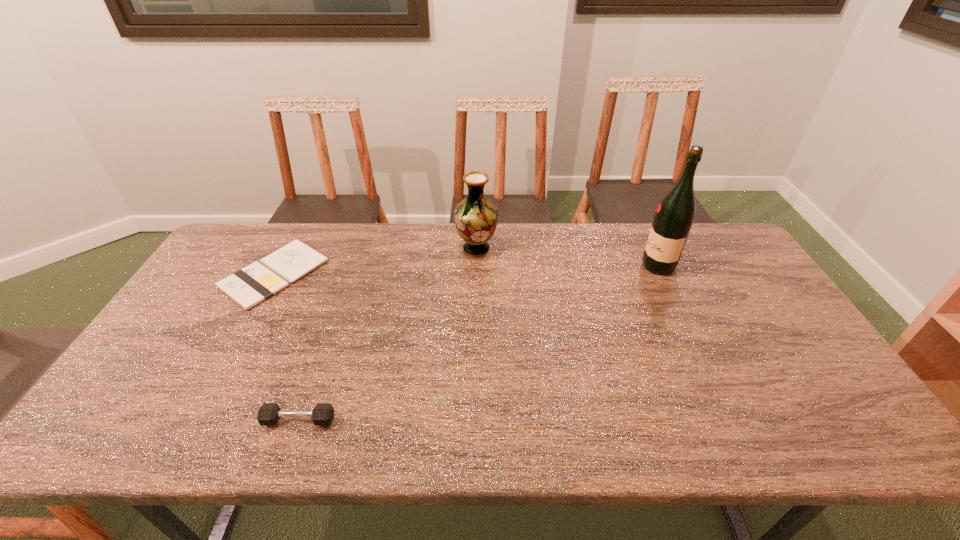
Image resolution: width=960 pixels, height=540 pixels. What are the coordinates of `the tallest object` in the screenshot? It's located at (674, 217).

Identify the location of the rightmost object. This screenshot has height=540, width=960. (674, 217).

Locate an element on the screen. Image resolution: width=960 pixels, height=540 pixels. the third shortest object is located at coordinates (476, 217).

Identify the location of vase. The width and height of the screenshot is (960, 540). (476, 217).

The width and height of the screenshot is (960, 540). What are the coordinates of `the nearest object` in the screenshot? It's located at (268, 414).

Where is `the second shortest object`? the second shortest object is located at coordinates (268, 414).

This screenshot has height=540, width=960. I want to click on notepad, so click(248, 287).

Locate an element on the screen. free space located 0.390m on the front-facing side of the liquor is located at coordinates (521, 266).

Locate an element on the screen. Image resolution: width=960 pixels, height=540 pixels. free region located 0.120m on the front-facing side of the liquor is located at coordinates (605, 266).

Image resolution: width=960 pixels, height=540 pixels. What are the coordinates of `vacant region located 0.100m on the front-facing side of the liquor` in the screenshot? It's located at (612, 266).